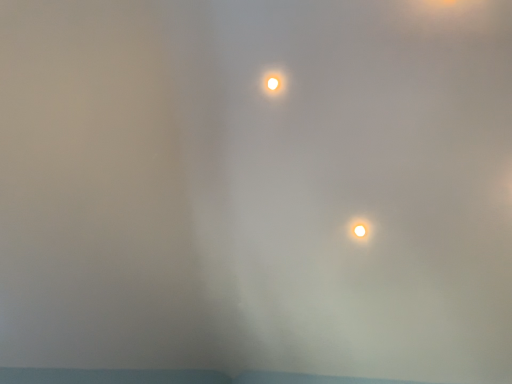
Describe the element at coordinates (360, 229) in the screenshot. I see `white glossy light at center` at that location.

In order to face white glossy light at center, should I rotate leftwards or rightwards?

You should rotate right by 13.897 degrees.

Identify the location of white glossy light at center. [x=360, y=229].

The height and width of the screenshot is (384, 512). Find the location of `white glossy light at center`. white glossy light at center is located at coordinates (360, 229).